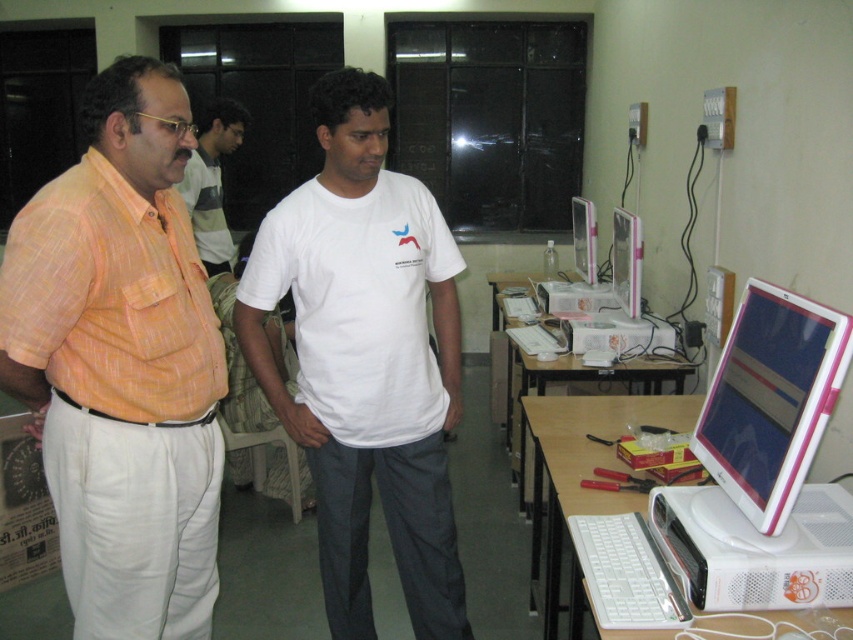
How much distance is there between white cotton t-shirt at center and pink plastic monitor at center right?

They are 29.74 inches apart.

Does white cotton t-shirt at center come behind pink plastic monitor at center right?

That is True.

Locate an element on the screen. This screenshot has width=853, height=640. white cotton t-shirt at center is located at coordinates (364, 358).

Can you confirm if orange cotton shirt at left is positioned above white glossy monitor at center?

No, orange cotton shirt at left is not above white glossy monitor at center.

Can you confirm if orange cotton shirt at left is taller than white glossy monitor at center?

Yes, orange cotton shirt at left is taller than white glossy monitor at center.

Which is behind, point (178, 216) or point (636, 278)?

The point (636, 278) is more distant.

Find the location of a particular element. The width and height of the screenshot is (853, 640). orange cotton shirt at left is located at coordinates (120, 364).

Which of these two, white cotton t-shirt at center or pink glossy monitor at center, stands shorter?

pink glossy monitor at center

Is white cotton t-shirt at center above pink glossy monitor at center?

Actually, white cotton t-shirt at center is below pink glossy monitor at center.

Locate an element on the screen. This screenshot has width=853, height=640. white cotton t-shirt at center is located at coordinates (364, 358).